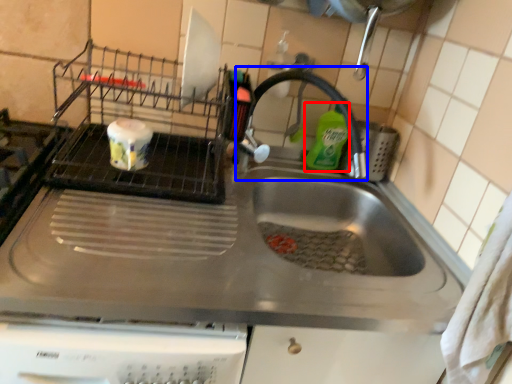
Question: Which object is closer to the camera taking this photo, cleaning product (highlighted by a red box) or faucet (highlighted by a blue box)?

Choices:
 (A) cleaning product
 (B) faucet

Answer: (B)